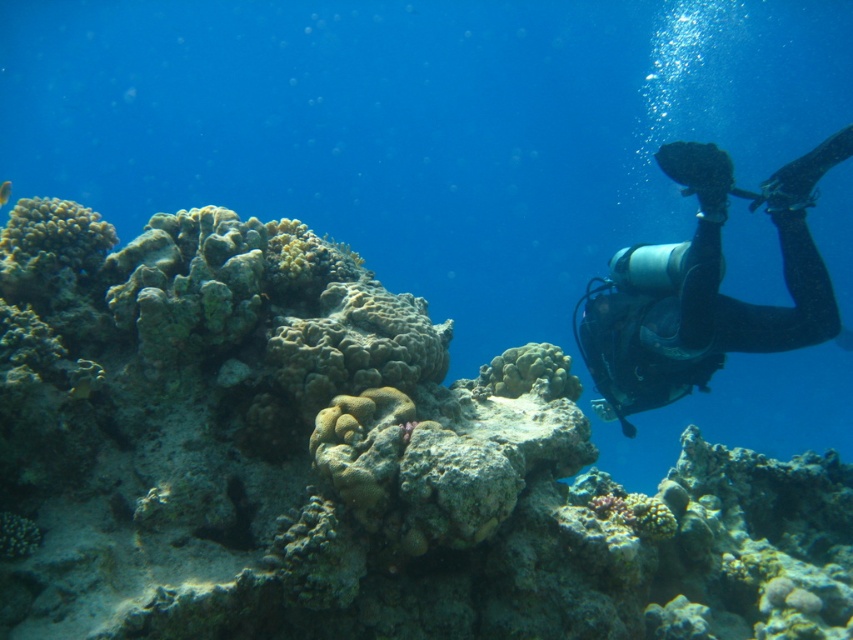
Between green textured coral reef at center and shiny blue fish at upper left, which one is positioned lower?

green textured coral reef at center is below.

Which is more to the left, green textured coral reef at center or shiny blue fish at upper left?

shiny blue fish at upper left

The width and height of the screenshot is (853, 640). Describe the element at coordinates (347, 464) in the screenshot. I see `green textured coral reef at center` at that location.

Where is `green textured coral reef at center`? green textured coral reef at center is located at coordinates (347, 464).

Is green textured coral reef at center taller than black rubber scuba diver at right?

Yes.

Can you confirm if green textured coral reef at center is wider than black rubber scuba diver at right?

Yes, green textured coral reef at center is wider than black rubber scuba diver at right.

Between point (625, 588) and point (619, 257), which one is positioned in front?

Point (625, 588) is more forward.

The image size is (853, 640). In order to click on green textured coral reef at center in this screenshot , I will do `click(347, 464)`.

Who is lower down, black rubber scuba diver at right or shiny blue fish at upper left?

black rubber scuba diver at right is lower down.

Who is positioned more to the right, black rubber scuba diver at right or shiny blue fish at upper left?

From the viewer's perspective, black rubber scuba diver at right appears more on the right side.

Does point (811, 200) come closer to viewer compared to point (7, 198)?

Yes, point (811, 200) is in front of point (7, 198).

Where is `black rubber scuba diver at right`? This screenshot has width=853, height=640. black rubber scuba diver at right is located at coordinates (705, 285).